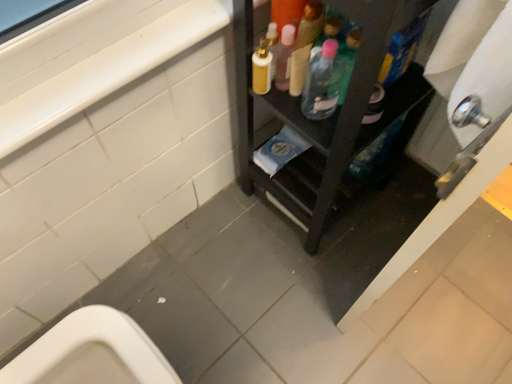
The width and height of the screenshot is (512, 384). Find the location of `translucent plastic bottle at center, positioned as the first bottle in left-to-right order`. translucent plastic bottle at center, positioned as the first bottle in left-to-right order is located at coordinates (322, 82).

You are a GUI agent. You are given a task and a screenshot of the screen. Output one action in this format:
    pyautogui.click(x=<x>, y=<y>)
    Task: Click on the translucent plastic bottle at upper center, positioned as the 2th bottle in left-to-right order
    This screenshot has height=384, width=512.
    Given the screenshot: What is the action you would take?
    click(348, 58)

Considering the sizes of objects black wood shelf at center and translucent plastic bottle at center, positioned as the first bottle in left-to-right order, in the image provided, who is bigger, black wood shelf at center or translucent plastic bottle at center, positioned as the first bottle in left-to-right order,?

black wood shelf at center is bigger.

Which of these two, black wood shelf at center or translucent plastic bottle at center, positioned as the first bottle in left-to-right order, stands taller?

black wood shelf at center is taller.

Does black wood shelf at center appear on the right side of translucent plastic bottle at center, positioned as the first bottle in left-to-right order?

Yes, black wood shelf at center is to the right of translucent plastic bottle at center, positioned as the first bottle in left-to-right order.

Considering the positions of points (391, 12) and (316, 105), is point (391, 12) closer to camera compared to point (316, 105)?

Yes.

Identify the location of furniture lying in front of the translucent plastic bottle at upper center, the first bottle from the right. Image resolution: width=512 pixels, height=384 pixels. (327, 118).

Consider the image. Is black wood shelf at center oriented towards translucent plastic bottle at upper center, the first bottle from the right?

Yes, black wood shelf at center is facing translucent plastic bottle at upper center, the first bottle from the right.

Between black wood shelf at center and translucent plastic bottle at upper center, positioned as the 2th bottle in left-to-right order, which one appears on the right side from the viewer's perspective?

From the viewer's perspective, translucent plastic bottle at upper center, positioned as the 2th bottle in left-to-right order, appears more on the right side.

Considering their positions, is black wood shelf at center located in front of or behind translucent plastic bottle at upper center, positioned as the 2th bottle in left-to-right order?

In the image, black wood shelf at center appears in front of translucent plastic bottle at upper center, positioned as the 2th bottle in left-to-right order.

Is translucent plastic bottle at upper center, the first bottle from the right, surrounding black wood shelf at center?

Actually, black wood shelf at center is outside translucent plastic bottle at upper center, the first bottle from the right.

Could you tell me if translucent plastic bottle at upper center, the first bottle from the right, is facing black wood shelf at center?

Yes, translucent plastic bottle at upper center, the first bottle from the right, faces towards black wood shelf at center.

Locate an element on the screen. furniture below the translucent plastic bottle at upper center, the first bottle from the right (from a real-world perspective) is located at coordinates (327, 118).

Does translucent plastic bottle at upper center, the first bottle from the right, have a smaller size compared to black wood shelf at center?

Correct, translucent plastic bottle at upper center, the first bottle from the right, occupies less space than black wood shelf at center.

Which is less distant, (347, 39) or (343, 69)?

Point (347, 39) is closer to the camera than point (343, 69).

Is translucent plastic bottle at upper center, positioned as the 2th bottle in left-to-right order, far away from translucent plastic bottle at center, positioned as the first bottle in left-to-right order?

No.

Is translucent plastic bottle at upper center, the first bottle from the right, turned away from translucent plastic bottle at center, positioned as the first bottle in left-to-right order?

No, translucent plastic bottle at upper center, the first bottle from the right, is not facing away from translucent plastic bottle at center, positioned as the first bottle in left-to-right order.

Can you confirm if translucent plastic bottle at center, positioned as the first bottle in left-to-right order, is thinner than translucent plastic bottle at upper center, positioned as the 2th bottle in left-to-right order?

No, translucent plastic bottle at center, positioned as the first bottle in left-to-right order, is not thinner than translucent plastic bottle at upper center, positioned as the 2th bottle in left-to-right order.

There is a translucent plastic bottle at center, positioned as the first bottle in left-to-right order. Where is `bottle above it (from a real-world perspective)`? This screenshot has width=512, height=384. bottle above it (from a real-world perspective) is located at coordinates (348, 58).

From a real-world perspective, who is located lower, translucent plastic bottle at center, positioned as the first bottle in left-to-right order, or translucent plastic bottle at upper center, the first bottle from the right?

translucent plastic bottle at center, positioned as the first bottle in left-to-right order.

Are translucent plastic bottle at center, marked as the 2th bottle in a right-to-left arrangement, and translucent plastic bottle at upper center, positioned as the 2th bottle in left-to-right order, beside each other?

Yes, translucent plastic bottle at center, marked as the 2th bottle in a right-to-left arrangement, is next to translucent plastic bottle at upper center, positioned as the 2th bottle in left-to-right order.

What's the angular difference between translucent plastic bottle at center, positioned as the first bottle in left-to-right order, and black wood shelf at center's facing directions?

The angular difference between translucent plastic bottle at center, positioned as the first bottle in left-to-right order, and black wood shelf at center is 87.9 degrees.

Which object is positioned more to the right, translucent plastic bottle at center, marked as the 2th bottle in a right-to-left arrangement, or black wood shelf at center?

black wood shelf at center is more to the right.

Is translucent plastic bottle at center, positioned as the first bottle in left-to-right order, further to camera compared to black wood shelf at center?

Yes, translucent plastic bottle at center, positioned as the first bottle in left-to-right order, is further from the camera.

Is translucent plastic bottle at center, positioned as the first bottle in left-to-right order, aimed at black wood shelf at center?

Yes, translucent plastic bottle at center, positioned as the first bottle in left-to-right order, faces towards black wood shelf at center.

From a real-world perspective, which bottle is the 1st one above the black wood shelf at center? Please provide its 2D coordinates.

[(322, 82)]

Find the location of a particular element. This screenshot has height=384, width=512. furniture located below the translucent plastic bottle at upper center, positioned as the 2th bottle in left-to-right order (from the image's perspective) is located at coordinates (327, 118).

Based on their spatial positions, is translucent plastic bottle at center, marked as the 2th bottle in a right-to-left arrangement, or translucent plastic bottle at upper center, the first bottle from the right, further from black wood shelf at center?

translucent plastic bottle at upper center, the first bottle from the right, is positioned further to the anchor black wood shelf at center.

Estimate the real-world distances between objects in this image. Which object is further from translucent plastic bottle at upper center, the first bottle from the right, translucent plastic bottle at center, positioned as the first bottle in left-to-right order, or black wood shelf at center?

Based on the image, black wood shelf at center appears to be further to translucent plastic bottle at upper center, the first bottle from the right.

Estimate the real-world distances between objects in this image. Which object is further from translucent plastic bottle at center, marked as the 2th bottle in a right-to-left arrangement, translucent plastic bottle at upper center, positioned as the 2th bottle in left-to-right order, or black wood shelf at center?

Among the two, black wood shelf at center is located further to translucent plastic bottle at center, marked as the 2th bottle in a right-to-left arrangement.

From the image, which object appears to be farther from translucent plastic bottle at center, positioned as the first bottle in left-to-right order, black wood shelf at center or translucent plastic bottle at upper center, the first bottle from the right?

black wood shelf at center lies further to translucent plastic bottle at center, positioned as the first bottle in left-to-right order, than the other object.

Estimate the real-world distances between objects in this image. Which object is further from translucent plastic bottle at upper center, the first bottle from the right, black wood shelf at center or translucent plastic bottle at center, positioned as the first bottle in left-to-right order?

black wood shelf at center is further to translucent plastic bottle at upper center, the first bottle from the right.

When comparing their distances from black wood shelf at center, does translucent plastic bottle at upper center, positioned as the 2th bottle in left-to-right order, or translucent plastic bottle at center, positioned as the first bottle in left-to-right order, seem further?

translucent plastic bottle at upper center, positioned as the 2th bottle in left-to-right order, is positioned further to the anchor black wood shelf at center.

I want to click on bottle between black wood shelf at center and translucent plastic bottle at center, marked as the 2th bottle in a right-to-left arrangement, in the front-back direction, so click(x=348, y=58).